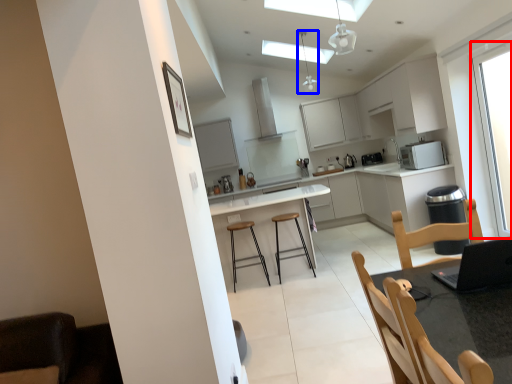
Question: Which point is further to the camera, window (highlighted by a red box) or light fixture (highlighted by a blue box)?

Choices:
 (A) window
 (B) light fixture

Answer: (B)